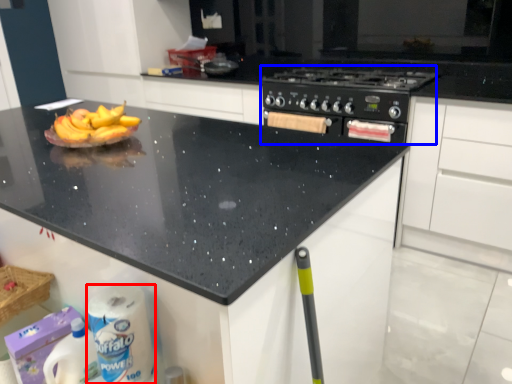
Question: Which object appears farthest to the camera in this image, toilet paper (highlighted by a red box) or appliance (highlighted by a blue box)?

Choices:
 (A) toilet paper
 (B) appliance

Answer: (B)